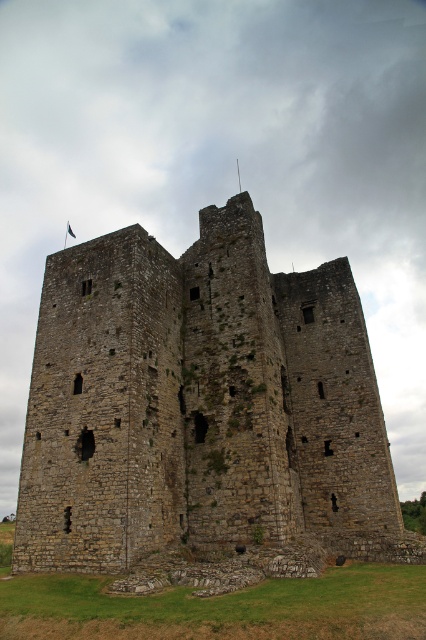
You are standing 50 meters away from a medieval stone tower. A point on the tower is located at coordinates point (187, 516). Is this point closer to you than your current position?

The distance of point (187, 516) from the camera is 49.90 meters, which is slightly closer than your current position of 50 meters away from the tower. Therefore, the point is closer to you than your current position.

You are an archer positioned at the base of the medieval stone tower. You spot two points on the tower wall marked as point [336,461] and point [68,221]. Which point is closer to you?

Point [336,461] is closer to the camera than point [68,221], so the archer should aim at point [336,461] since it is nearer.

You are a medieval knight standing at the base of the brown stone castle at center. You notice the black fabric flag at upper center flying in the wind. Can you estimate which object is taller?

The brown stone castle at center is larger in size than the black fabric flag at upper center, so the brown stone castle at center is taller than the black fabric flag at upper center.